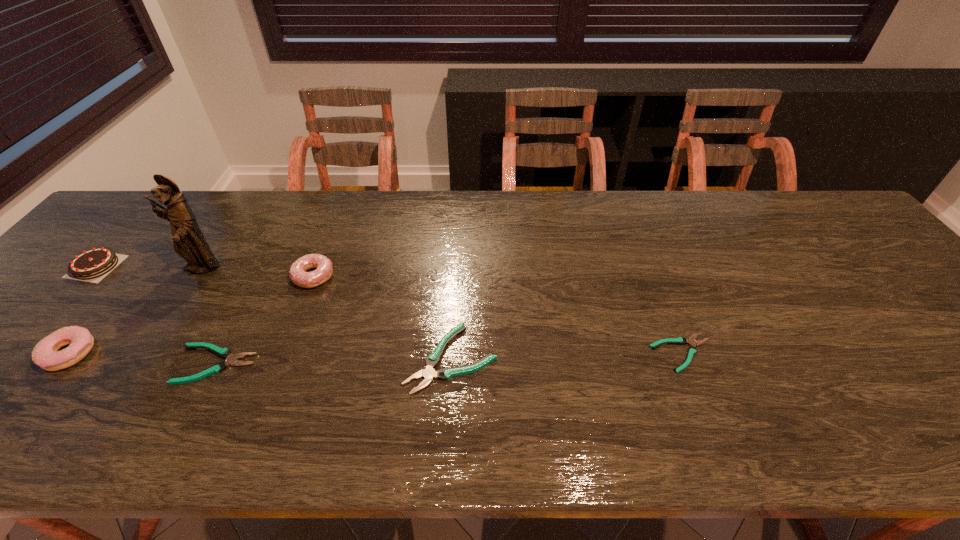
This screenshot has width=960, height=540. In order to click on vacant region that satisfies the following two spatial constraints: 1. on the front-facing side of the third object from left to right; 2. on the left side of the tallest pliers in this screenshot , I will do `click(144, 359)`.

Identify the location of vacant space that satisfies the following two spatial constraints: 1. on the front-facing side of the figurine; 2. on the left side of the right doughnut. (197, 276).

At what (x,y) coordinates should I click in order to perform the action: click on vacant space that satisfies the following two spatial constraints: 1. on the front side of the fifth object from left to right; 2. on the left side of the rightmost pliers. Please return your answer as a coordinate pair (x, y). The height and width of the screenshot is (540, 960). Looking at the image, I should click on (284, 353).

Where is `vacant region that satisfies the following two spatial constraints: 1. on the front side of the chocolate cake; 2. on the left side of the left doughnut`? The height and width of the screenshot is (540, 960). vacant region that satisfies the following two spatial constraints: 1. on the front side of the chocolate cake; 2. on the left side of the left doughnut is located at coordinates (19, 353).

Locate an element on the screen. vacant space that satisfies the following two spatial constraints: 1. on the front-facing side of the third object from left to right; 2. on the right side of the shortest object is located at coordinates (148, 353).